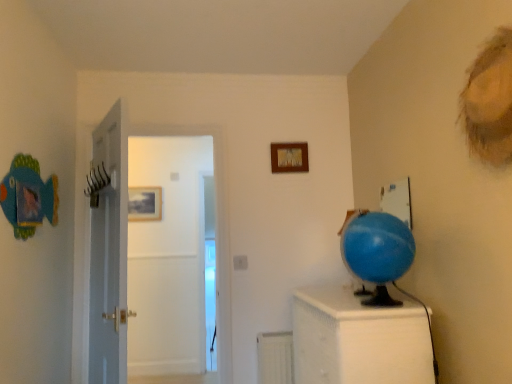
Question: Considering the positions of blue rubber globe at right and white glossy door at center in the image, is blue rubber globe at right taller or shorter than white glossy door at center?

Choices:
 (A) tall
 (B) short

Answer: (B)

Question: From a real-world perspective, is blue rubber globe at right positioned above or below white glossy door at center?

Choices:
 (A) below
 (B) above

Answer: (A)

Question: Based on their relative distances, which object is nearer to the blue rubber globe at right?

Choices:
 (A) white matte radiator at lower center
 (B) matte wooden picture frame at center, which appears as the second picture frame when viewed from the right
 (C) white glossy door at center
 (D) white textured cabinet at right
 (E) wooden picture frame at upper center, acting as the second picture frame starting from the back

Answer: (D)

Question: Based on their relative distances, which object is farther from the blue rubber globe at right?

Choices:
 (A) matte wooden picture frame at center, marked as the second picture frame in a front-to-back arrangement
 (B) white textured cabinet at right
 (C) white glossy door at center
 (D) wooden picture frame at upper center, which appears as the first picture frame when viewed from the right
 (E) white matte radiator at lower center

Answer: (A)